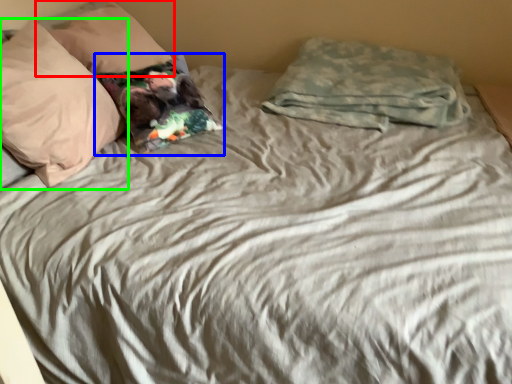
Question: Which is nearer to the pillow (highlighted by a red box)? pillow (highlighted by a blue box) or pillow (highlighted by a green box).

Choices:
 (A) pillow
 (B) pillow

Answer: (A)